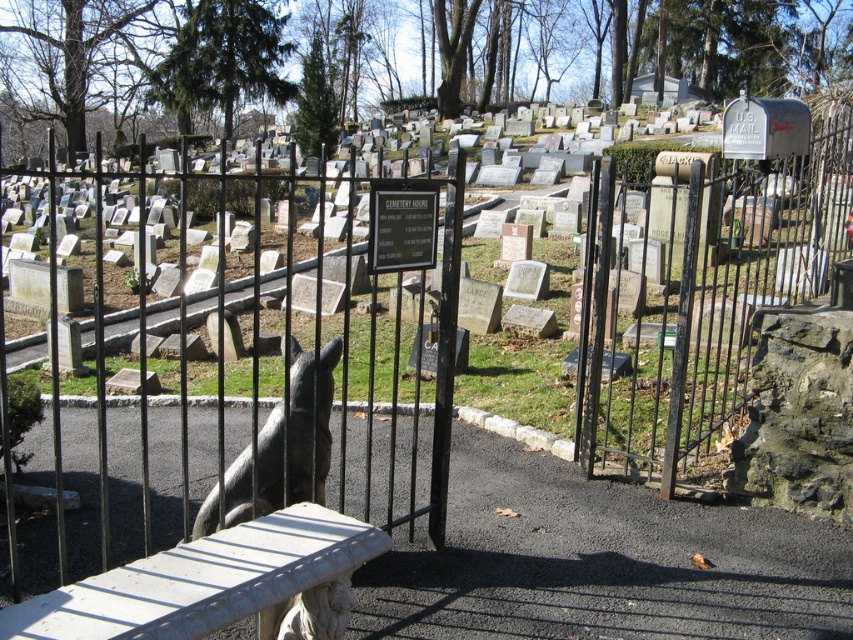
You are a tour guide explaining the cemetery layout to visitors. Pointing to the rusty metal gate at right and the shiny black statue at center, you want to clarify their relative heights. Which object is taller?

The rusty metal gate at right is much taller than the shiny black statue at center.

From the picture: You are a visitor entering the cemetery through the black wrought iron gate at center and want to see the shiny black statue at center. Based on their heights, which one is taller?

The black wrought iron gate at center is taller than the shiny black statue at center.

You are a visitor approaching the cemetery and see the black wrought iron gate at center and the rusty metal gate at right. Which gate is directly in front of you as you face the cemetery entrance?

The black wrought iron gate at center is directly in front of you because it is positioned over the rusty metal gate at right, meaning it is closer to your viewpoint.